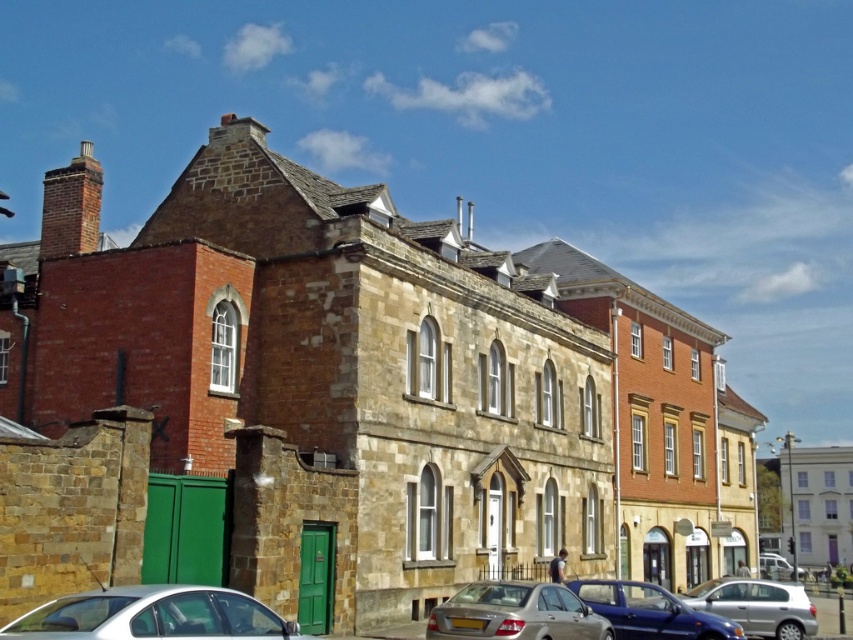
You are standing at the point labeled as point (515, 612) in the image. What object are you currently standing on?

You are standing on the satin silver sedan at lower center, as the point (515, 612) is located on it.

You are driving a car and want to park in front of the central light stone building with arched windows. There is a satin silver sedan at lower center and a silver metallic hatchback at lower right in your way. Which car do you need to move to access the parking spot near the central building?

The satin silver sedan at lower center is closer to the viewer than the silver metallic hatchback at lower right, so you need to move the satin silver sedan at lower center first to access the parking spot near the central building.

You are a pedestrian standing at the entrance of the central stone building and want to cross the street to reach the green gate on the left. There are two cars in your path. Can you safely walk between the satin silver sedan at lower center and the blue metallic car at center without stepping into the road?

The satin silver sedan at lower center is above the blue metallic car at center, so they are likely parked in a way that creates a safe pathway between them for pedestrians to cross without entering the road.